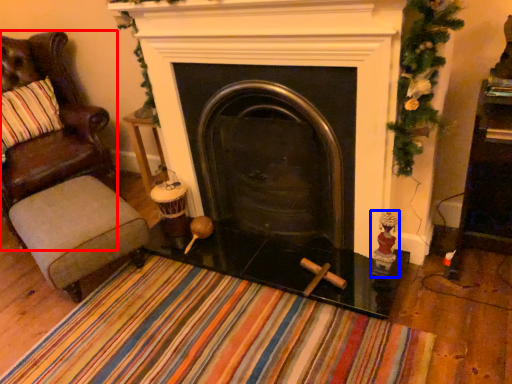
Question: Among these objects, which one is nearest to the camera, chair (highlighted by a red box) or toy (highlighted by a blue box)?

Choices:
 (A) chair
 (B) toy

Answer: (B)